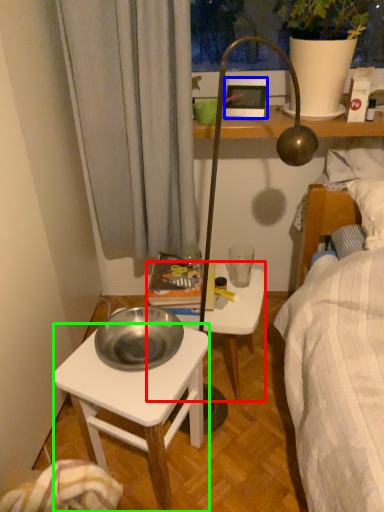
Question: Which object is positioned closest to stool (highlighted by a red box)? Select from picture frame (highlighted by a blue box) and desk (highlighted by a green box).

Choices:
 (A) picture frame
 (B) desk

Answer: (B)